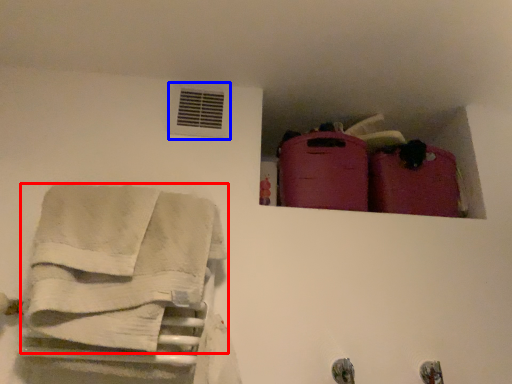
Question: Among these objects, which one is farthest to the camera, towel (highlighted by a red box) or air conditioning (highlighted by a blue box)?

Choices:
 (A) towel
 (B) air conditioning

Answer: (B)